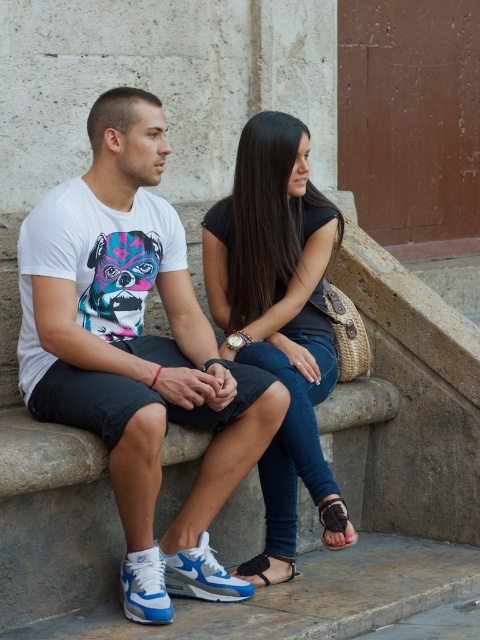
Question: Is white matte t-shirt at center behind brown leather sandal at lower center?

Choices:
 (A) no
 (B) yes

Answer: (A)

Question: Estimate the real-world distances between objects in this image. Which object is closer to the brown leather sandal at lower center?

Choices:
 (A) black leather sandal at lower center
 (B) white matte t-shirt at center

Answer: (A)

Question: Is white matte t-shirt at center bigger than black leather sandal at lower center?

Choices:
 (A) yes
 (B) no

Answer: (A)

Question: Estimate the real-world distances between objects in this image. Which object is closer to the brown leather sandal at lower center?

Choices:
 (A) black matte jeans at center
 (B) black leather sandal at lower center
 (C) white matte t-shirt at center

Answer: (B)

Question: Can you confirm if white matte t-shirt at center is positioned below black matte jeans at center?

Choices:
 (A) yes
 (B) no

Answer: (A)

Question: Among these objects, which one is nearest to the camera?

Choices:
 (A) brown leather sandal at lower center
 (B) black leather sandal at lower center

Answer: (A)